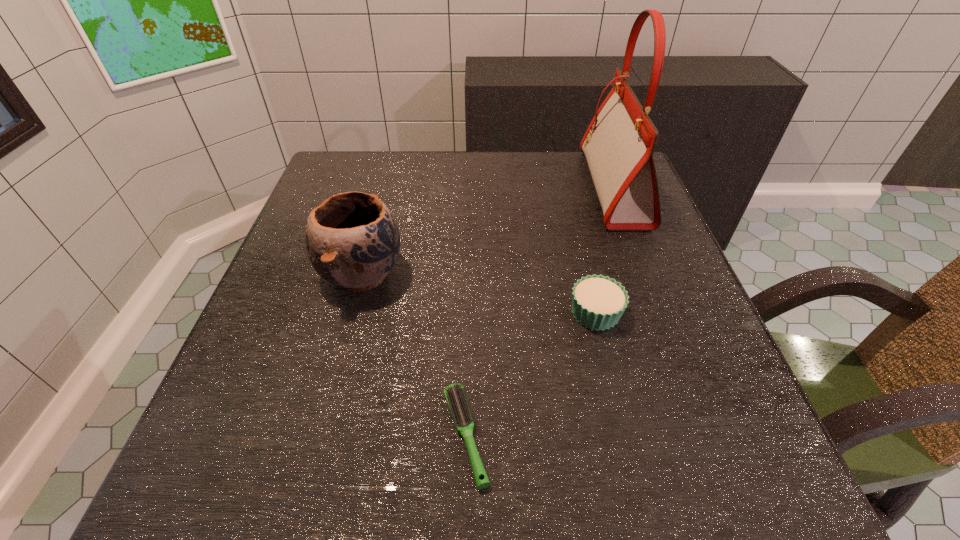
Where is `the farthest object`? Image resolution: width=960 pixels, height=540 pixels. the farthest object is located at coordinates (619, 143).

Image resolution: width=960 pixels, height=540 pixels. I want to click on the tallest object, so click(619, 143).

Locate an element on the screen. The height and width of the screenshot is (540, 960). the leftmost object is located at coordinates (352, 239).

Find the location of a particular element. The width and height of the screenshot is (960, 540). the third shortest object is located at coordinates [x=352, y=239].

Find the location of a particular element. The height and width of the screenshot is (540, 960). the third tallest object is located at coordinates (598, 302).

I want to click on the second object from right to left, so click(598, 302).

Locate an element on the screen. The image size is (960, 540). hairbrush is located at coordinates (455, 395).

This screenshot has width=960, height=540. I want to click on the shortest object, so click(x=455, y=395).

Find the location of a particular element. vacant space located on the front of the rightmost object is located at coordinates (656, 298).

Identify the location of vacant area located on the front of the second tallest object. Image resolution: width=960 pixels, height=540 pixels. (304, 488).